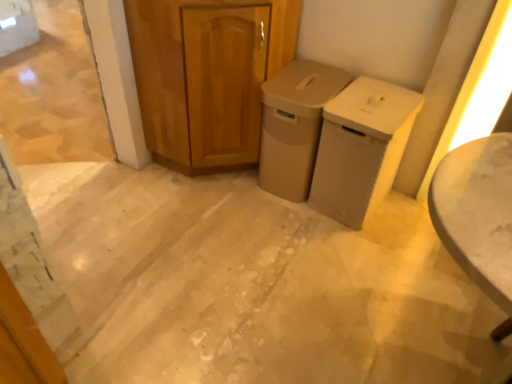
Locate an element on the screen. free point to the left of beige textured waste bin at center-right, positioned as the first waste container in right-to-left order is located at coordinates (279, 216).